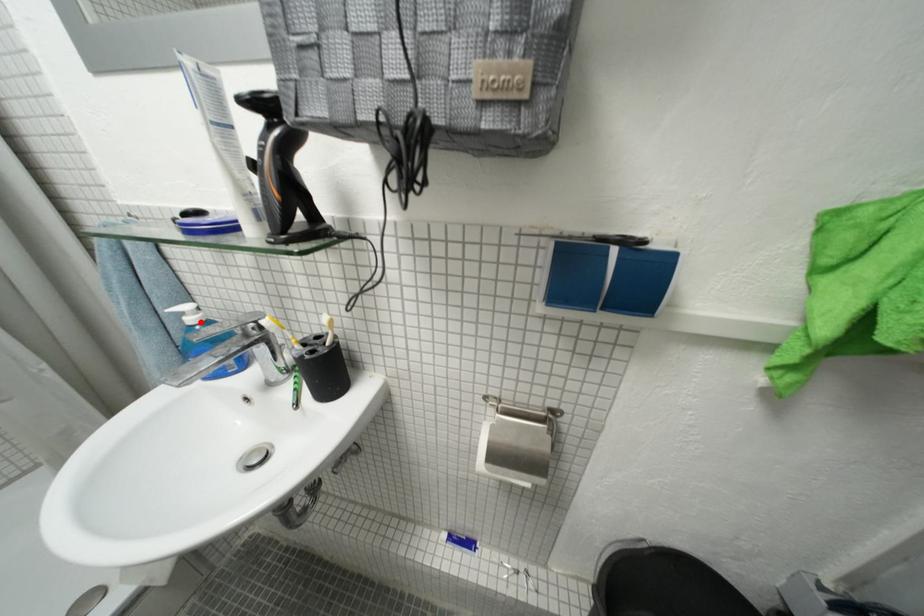
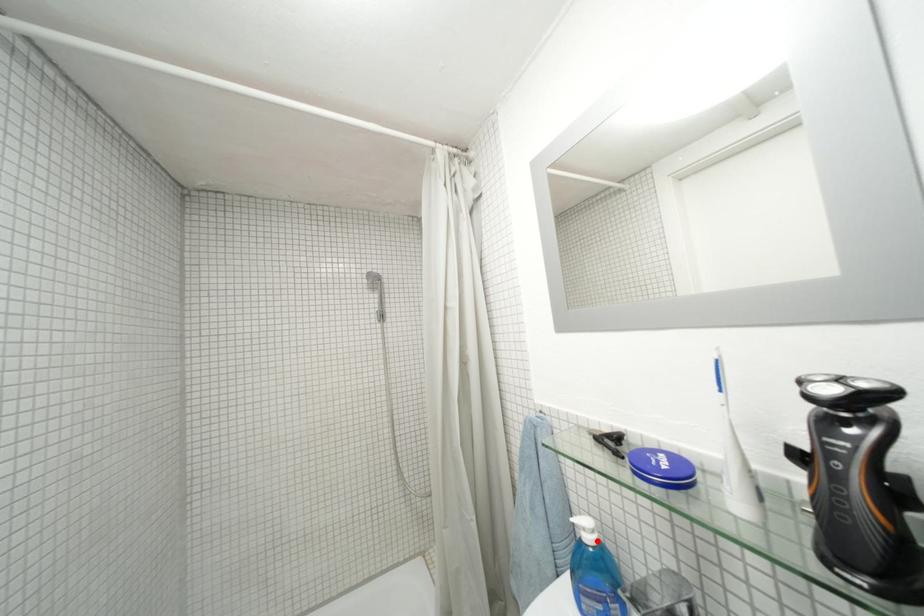
I am providing you with two images of the same scene from different viewpoints. A red point is marked on the first image and another point is marked on the second image. Does the point marked in image1 correspond to the same location as the one in image2?

Yes